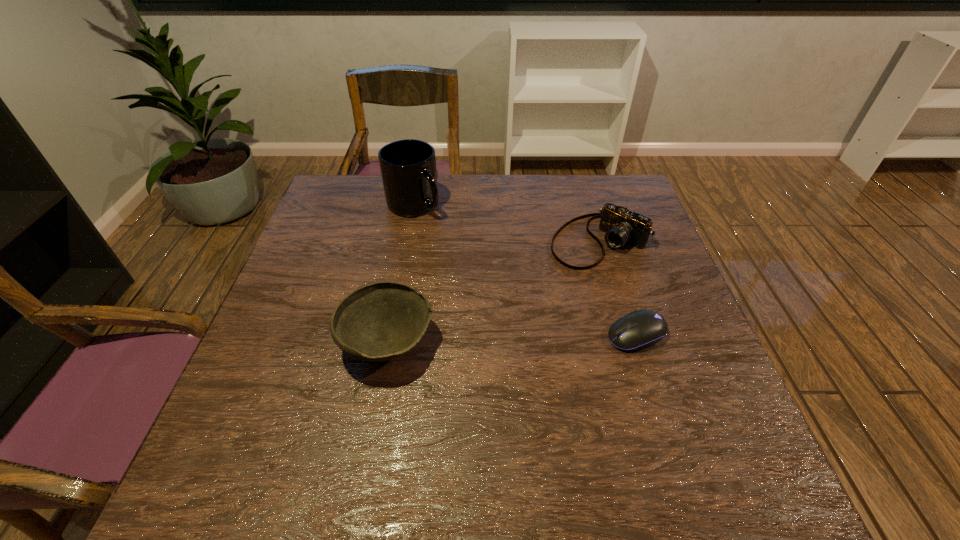
This screenshot has height=540, width=960. Identify the location of free space on the desktop that is between the bowl and the computer mouse and is positioned with the handle on the side of the tallest object. (504, 339).

Locate an element on the screen. free space on the desktop that is between the bowl and the shortest object and is positioned on the front-facing side of the camera is located at coordinates (484, 340).